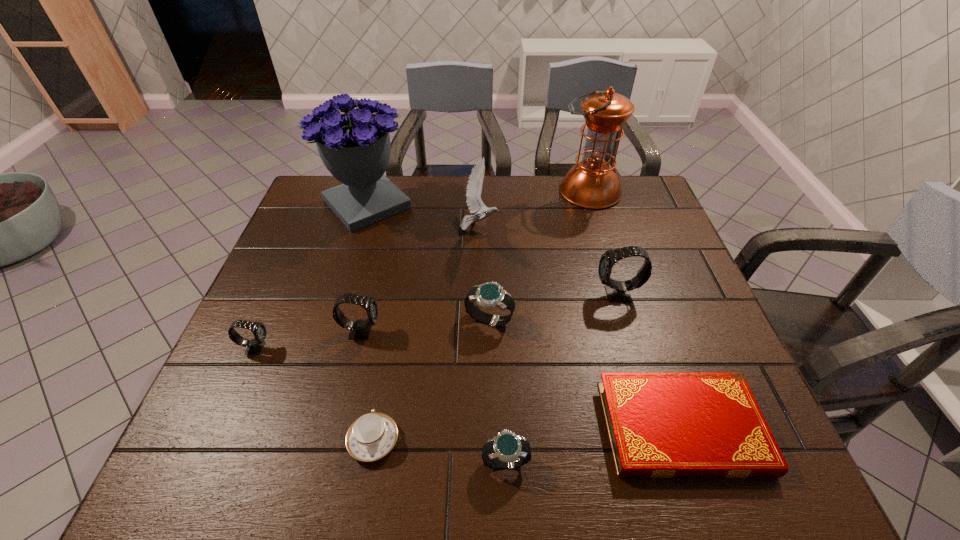
Where is `empty location between the smaller silver watch and the gull`? This screenshot has width=960, height=540. empty location between the smaller silver watch and the gull is located at coordinates (492, 345).

Identify which object is located as the seventh nearest to the gull. Please provide its 2D coordinates. Your answer should be formatted as a tuple, i.e. [(x, y)], where the tuple contains the x and y coordinates of a point satisfying the conditions above.

[(372, 436)]

Identify the location of object that is the fifth closest to the bigger silver watch. This screenshot has width=960, height=540. (372, 436).

At what (x,y) coordinates should I click in order to perform the action: click on watch identified as the fifth closest to the oil lamp. Please return your answer as a coordinate pair (x, y). The height and width of the screenshot is (540, 960). Looking at the image, I should click on (254, 346).

In order to click on watch that is the fourth nearest to the bouquet in this screenshot , I will do `click(617, 291)`.

This screenshot has height=540, width=960. In order to click on gray watch that is the second nearest to the hardback book in this screenshot , I will do `click(360, 329)`.

Identify the location of gray watch that stands as the closest to the leftmost gray watch. Image resolution: width=960 pixels, height=540 pixels. (360, 329).

Where is `free space in the image that satisfies the following two spatial constraints: 1. on the front side of the farther silver watch; 2. on the face of the leftmost gray watch`? The width and height of the screenshot is (960, 540). free space in the image that satisfies the following two spatial constraints: 1. on the front side of the farther silver watch; 2. on the face of the leftmost gray watch is located at coordinates (490, 348).

This screenshot has width=960, height=540. In order to click on vacant area that satisfies the following two spatial constraints: 1. on the side with the handle of the farther silver watch; 2. on the left side of the teacup in this screenshot , I will do `click(395, 319)`.

Identify the location of vacant area in the image that satisfies the following two spatial constraints: 1. on the face of the sixth shortest object; 2. on the side with the handle of the second shortest object. The height and width of the screenshot is (540, 960). click(x=335, y=440).